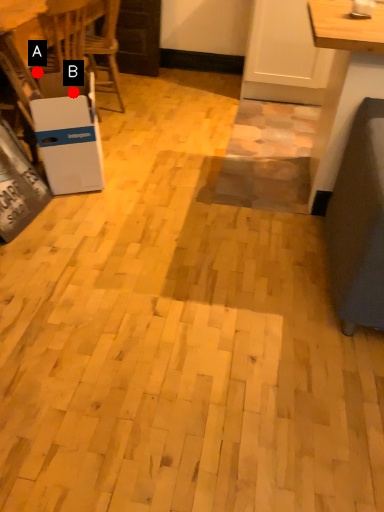
Question: Two points are circled on the image, labeled by A and B beside each circle. Which point is closer to the camera?

Choices:
 (A) A is closer
 (B) B is closer

Answer: (B)